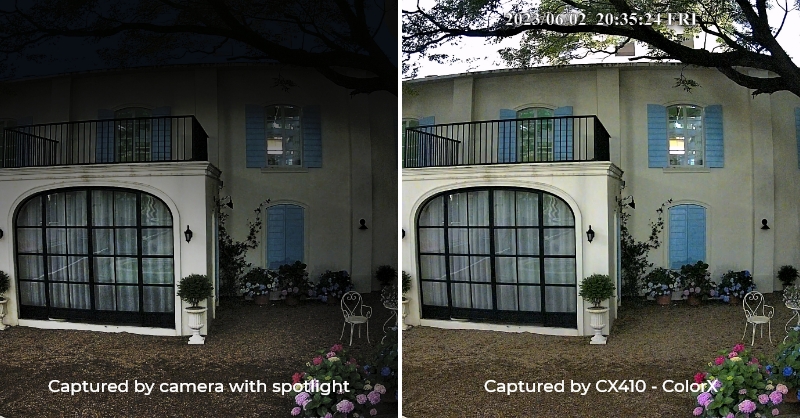
Find the location of a particular element. This screenshot has height=418, width=800. closed blue shutters is located at coordinates (694, 233), (672, 232), (288, 222), (272, 238).